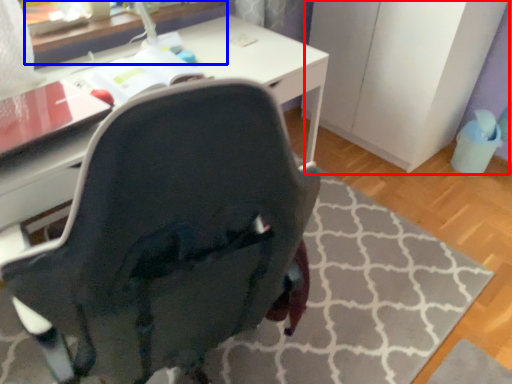
Question: Which object is further to the camera taking this photo, file cabinet (highlighted by a red box) or table (highlighted by a blue box)?

Choices:
 (A) file cabinet
 (B) table

Answer: (A)